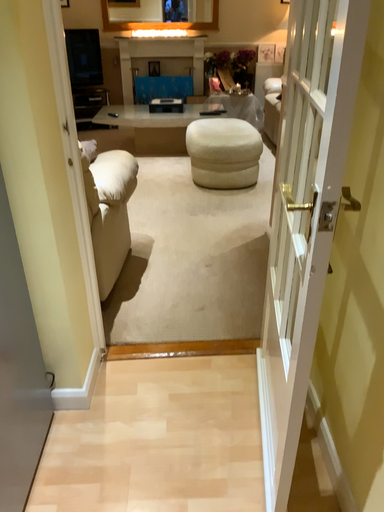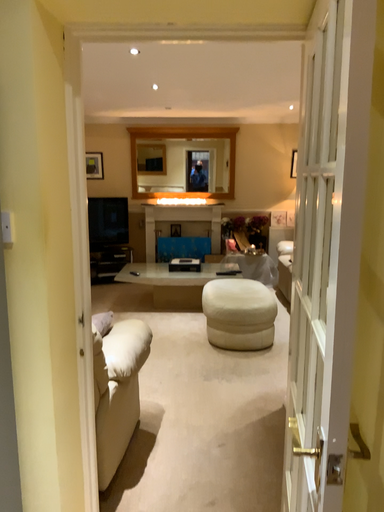
Question: How did the camera likely rotate when shooting the video?

Choices:
 (A) rotated upward
 (B) rotated downward

Answer: (A)